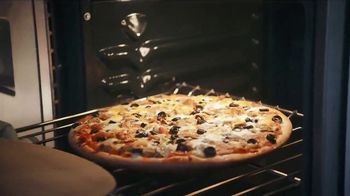
Where is `potholder`? This screenshot has width=350, height=196. potholder is located at coordinates (5, 130).